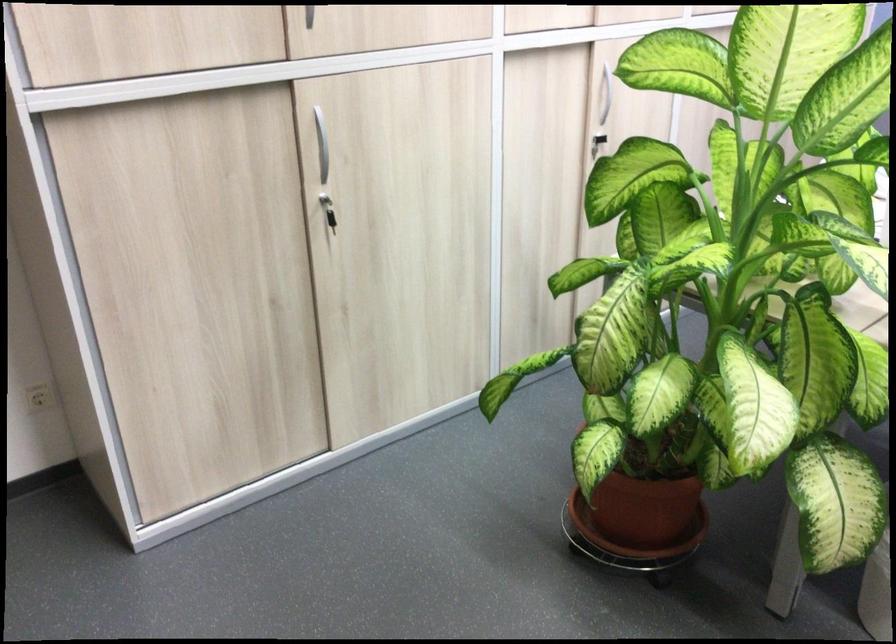
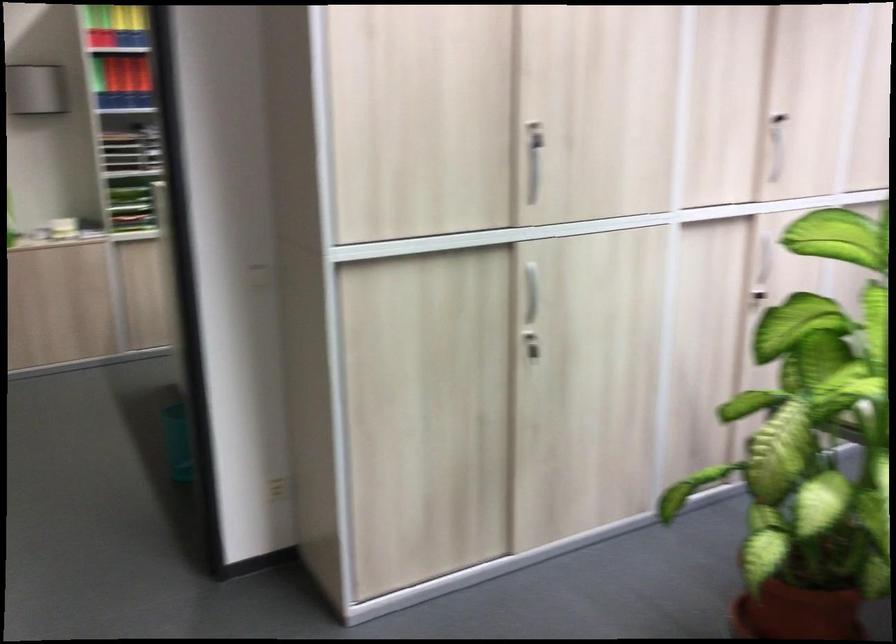
What movement of the cameraman would produce the second image?

The cameraman moved toward left, backward.